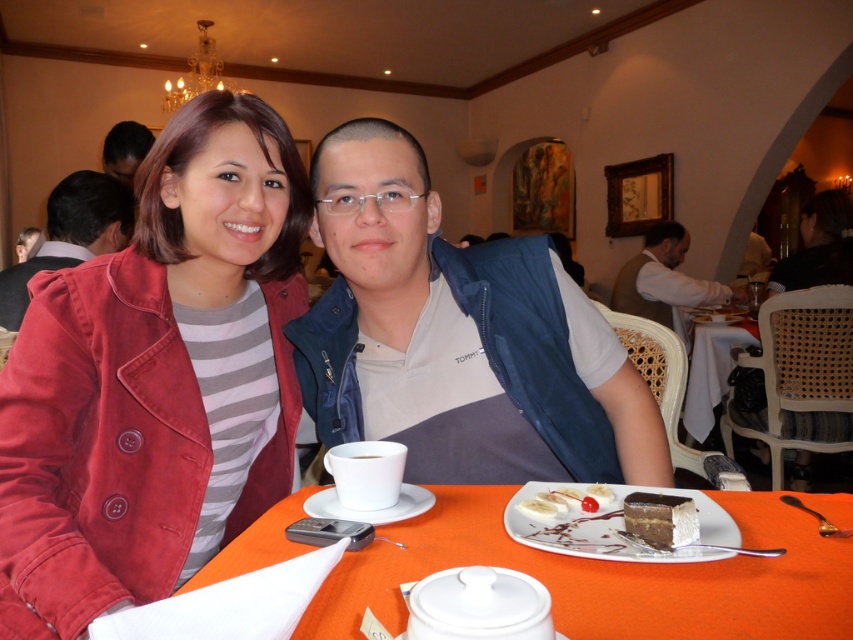
Does orange fabric table at lower center appear over light brown vest at right?

No.

Which is more to the right, orange fabric table at lower center or light brown vest at right?

light brown vest at right

Is point (631, 573) positioned before point (724, 289)?

Yes, point (631, 573) is in front of point (724, 289).

What are the coordinates of `orange fabric table at lower center` in the screenshot? It's located at (605, 576).

Based on the photo, can you confirm if chocolate frosted cake at center is shorter than white ceramic saucer at lower center?

No.

Which is in front, point (689, 536) or point (323, 516)?

Positioned in front is point (689, 536).

You are a GUI agent. You are given a task and a screenshot of the screen. Output one action in this format:
    pyautogui.click(x=<x>, y=<y>)
    Task: Click on the chocolate frosted cake at center
    Image resolution: width=853 pixels, height=640 pixels.
    Given the screenshot: What is the action you would take?
    pyautogui.click(x=660, y=518)

Where is `chocolate frosted cake at center`? The image size is (853, 640). chocolate frosted cake at center is located at coordinates (660, 518).

Who is taller, chocolate frosted cake at center or dark brown hair at upper left?

dark brown hair at upper left is taller.

Looking at this image, can you confirm if chocolate frosted cake at center is positioned to the left of dark brown hair at upper left?

In fact, chocolate frosted cake at center is to the right of dark brown hair at upper left.

Measure the distance between point (647,502) and camera.

They are 30.03 inches apart.

At what (x,y) coordinates should I click in order to perform the action: click on chocolate frosted cake at center. Please return your answer as a coordinate pair (x, y). Image resolution: width=853 pixels, height=640 pixels. Looking at the image, I should click on (660, 518).